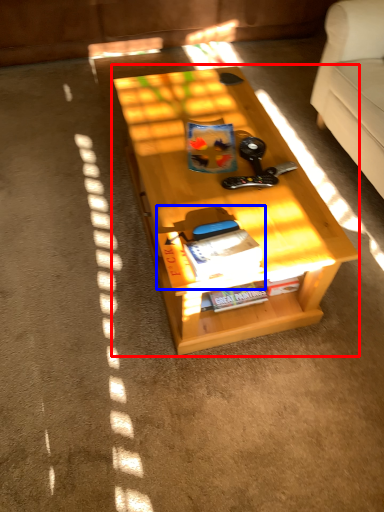
Question: Among these objects, which one is nearest to the camera, table (highlighted by a red box) or book (highlighted by a blue box)?

Choices:
 (A) table
 (B) book

Answer: (B)